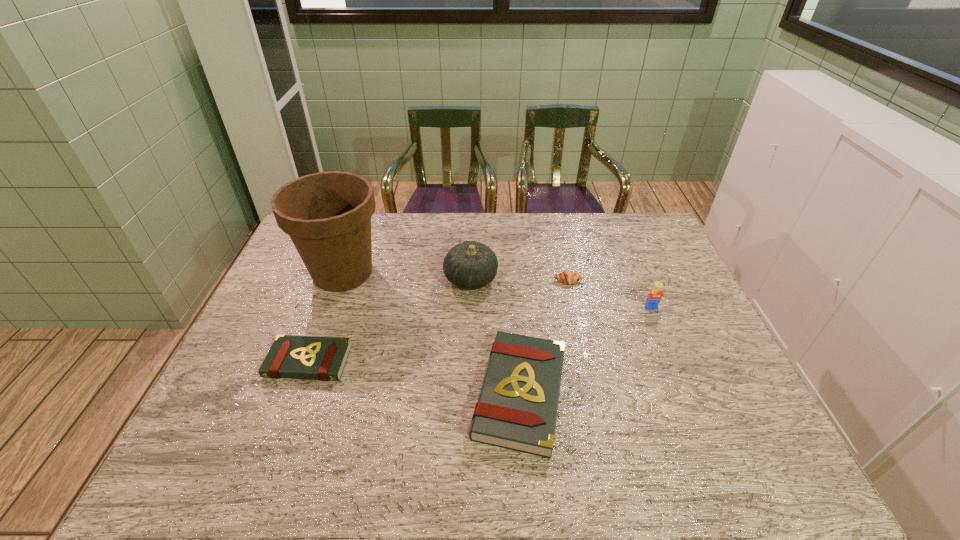
I want to click on vacant place for an extra book on the right, so click(763, 430).